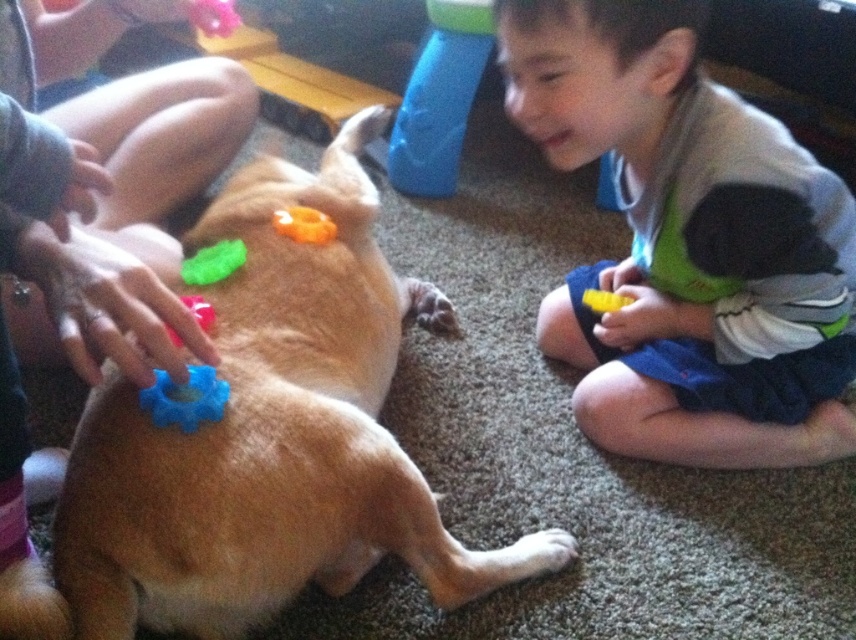
Is brown matte dog at center taller than green rubber toy at upper left?

Indeed, brown matte dog at center has a greater height compared to green rubber toy at upper left.

Is brown matte dog at center to the right of green rubber toy at upper left from the viewer's perspective?

Correct, you'll find brown matte dog at center to the right of green rubber toy at upper left.

Identify the location of brown matte dog at center. This screenshot has height=640, width=856. (272, 435).

Does brown matte dog at center have a greater width compared to blue rubber toy at lower left?

Correct, the width of brown matte dog at center exceeds that of blue rubber toy at lower left.

Based on the photo, is brown matte dog at center smaller than blue rubber toy at lower left?

Actually, brown matte dog at center might be larger than blue rubber toy at lower left.

Who is more distant from viewer, (105, 486) or (227, 392)?

The point (227, 392) is more distant.

At what (x,y) coordinates should I click in order to perform the action: click on brown matte dog at center. Please return your answer as a coordinate pair (x, y). The height and width of the screenshot is (640, 856). Looking at the image, I should click on (272, 435).

Which is in front, point (317, 499) or point (614, 307)?

Positioned in front is point (317, 499).

Between brown matte dog at center and yellow plastic toy at lower center, which one appears on the right side from the viewer's perspective?

From the viewer's perspective, yellow plastic toy at lower center appears more on the right side.

Which is behind, point (187, 460) or point (627, 305)?

The point (627, 305) is more distant.

The width and height of the screenshot is (856, 640). In order to click on brown matte dog at center in this screenshot , I will do `click(272, 435)`.